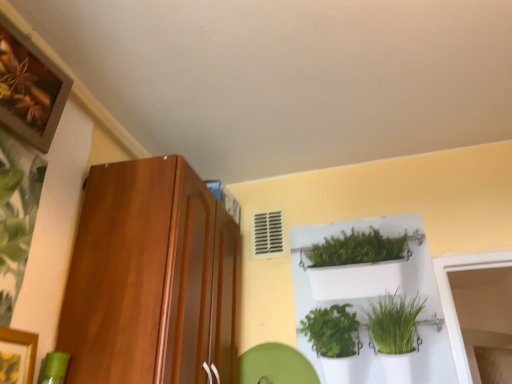
Describe the element at coordinates (365, 283) in the screenshot. I see `white plastic shelf at upper center` at that location.

Where is `white plastic shelf at upper center`? The height and width of the screenshot is (384, 512). white plastic shelf at upper center is located at coordinates (365, 283).

Locate an element on the screen. The width and height of the screenshot is (512, 384). wooden framed artwork at upper left is located at coordinates (29, 88).

Describe the element at coordinates (16, 215) in the screenshot. I see `green leafy plant at left` at that location.

The width and height of the screenshot is (512, 384). I want to click on shiny brown cabinet at left, so click(x=140, y=275).

Find the location of a particular element. Image resolution: width=512 pixels, height=384 pixels. white plastic shelf at upper center is located at coordinates (365, 283).

Consider the image. Are green leafy plant at left and shiny brown cabinet at left far apart?

No, green leafy plant at left is not far from shiny brown cabinet at left.

Is point (34, 202) in front of point (103, 260)?

Yes, point (34, 202) is in front of point (103, 260).

Does green leafy plant at left have a greater height compared to shiny brown cabinet at left?

In fact, green leafy plant at left may be shorter than shiny brown cabinet at left.

Does green leafy plant at left come behind shiny brown cabinet at left?

No, green leafy plant at left is closer to the viewer.

Between white plastic shelf at upper center and green leafy plant at left, which one has less height?

With less height is green leafy plant at left.

Is white plastic shelf at upper center spatially inside green leafy plant at left, or outside of it?

white plastic shelf at upper center lies outside green leafy plant at left.

Is point (416, 293) more distant than point (26, 159)?

Yes, point (416, 293) is behind point (26, 159).

Who is shorter, white plastic shelf at upper center or shiny brown cabinet at left?

shiny brown cabinet at left is shorter.

Is white plastic shelf at upper center surrounding shiny brown cabinet at left?

No, shiny brown cabinet at left is not inside white plastic shelf at upper center.

Does point (401, 258) come closer to viewer compared to point (161, 372)?

No, it is behind (161, 372).

In terms of width, does white plastic shelf at upper center look wider or thinner when compared to shiny brown cabinet at left?

Considering their sizes, white plastic shelf at upper center looks slimmer than shiny brown cabinet at left.

Which point is more distant from viewer, (44, 129) or (325, 291)?

The point (325, 291) is behind.

Can you see wooden framed artwork at upper left touching white plastic shelf at upper center?

wooden framed artwork at upper left and white plastic shelf at upper center are clearly separated.

Is wooden framed artwork at upper left aimed at white plastic shelf at upper center?

No, wooden framed artwork at upper left is not aimed at white plastic shelf at upper center.

Is wooden framed artwork at upper left at the left side of white plastic shelf at upper center?

Yes.

Can you confirm if white plastic shelf at upper center is thinner than wooden framed artwork at upper left?

Indeed, white plastic shelf at upper center has a lesser width compared to wooden framed artwork at upper left.

What's the angular difference between white plastic shelf at upper center and wooden framed artwork at upper left's facing directions?

Answer: The angular difference between white plastic shelf at upper center and wooden framed artwork at upper left is 82.7 degrees.

Where is `picture frame lying above the white plastic shelf at upper center (from the image's perspective)`? The width and height of the screenshot is (512, 384). picture frame lying above the white plastic shelf at upper center (from the image's perspective) is located at coordinates (29, 88).

Considering the relative sizes of white plastic shelf at upper center and wooden framed artwork at upper left in the image provided, is white plastic shelf at upper center smaller than wooden framed artwork at upper left?

Incorrect, white plastic shelf at upper center is not smaller in size than wooden framed artwork at upper left.

Locate an element on the screen. plant on the right of wooden framed artwork at upper left is located at coordinates (16, 215).

Is point (13, 222) in front of point (66, 77)?

Yes, point (13, 222) is closer to viewer.

From the image's perspective, is green leafy plant at left on top of wooden framed artwork at upper left?

No, from the image's perspective, green leafy plant at left is not on top of wooden framed artwork at upper left.

How distant is green leafy plant at left from wooden framed artwork at upper left?

green leafy plant at left is 16.11 centimeters away from wooden framed artwork at upper left.

Could you tell me if shiny brown cabinet at left is turned towards wooden framed artwork at upper left?

No, shiny brown cabinet at left is not oriented towards wooden framed artwork at upper left.

Relative to wooden framed artwork at upper left, is shiny brown cabinet at left in front or behind?

Visually, shiny brown cabinet at left is located behind wooden framed artwork at upper left.

Which is more distant, (x=106, y=360) or (x=17, y=28)?

The point (x=17, y=28) is farther from the camera.

From the image's perspective, is shiny brown cabinet at left below wooden framed artwork at upper left?

Correct, shiny brown cabinet at left appears lower than wooden framed artwork at upper left in the image.

Find the location of a particular element. The height and width of the screenshot is (384, 512). cabinetry that appears above the green leafy plant at left (from a real-world perspective) is located at coordinates (140, 275).

Find the location of a particular element. The width and height of the screenshot is (512, 384). plant that appears above the white plastic shelf at upper center (from the image's perspective) is located at coordinates (16, 215).

Which object lies further to the anchor point green leafy plant at left, shiny brown cabinet at left or white plastic shelf at upper center?

white plastic shelf at upper center is further to green leafy plant at left.

Looking at the image, which one is located further to white plastic shelf at upper center, shiny brown cabinet at left or wooden framed artwork at upper left?

wooden framed artwork at upper left lies further to white plastic shelf at upper center than the other object.

Consider the image. Considering their positions, is wooden framed artwork at upper left positioned further to shiny brown cabinet at left than green leafy plant at left?

wooden framed artwork at upper left lies further to shiny brown cabinet at left than the other object.

Estimate the real-world distances between objects in this image. Which object is closer to shiny brown cabinet at left, white plastic shelf at upper center or green leafy plant at left?

The object closer to shiny brown cabinet at left is green leafy plant at left.

Looking at the image, which one is located closer to white plastic shelf at upper center, wooden framed artwork at upper left or shiny brown cabinet at left?

Among the two, shiny brown cabinet at left is located nearer to white plastic shelf at upper center.

Estimate the real-world distances between objects in this image. Which object is closer to shiny brown cabinet at left, wooden framed artwork at upper left or white plastic shelf at upper center?

Among the two, wooden framed artwork at upper left is located nearer to shiny brown cabinet at left.

When comparing their distances from green leafy plant at left, does shiny brown cabinet at left or wooden framed artwork at upper left seem further?

shiny brown cabinet at left is further to green leafy plant at left.

Considering their positions, is green leafy plant at left positioned closer to white plastic shelf at upper center than shiny brown cabinet at left?

The object closer to white plastic shelf at upper center is shiny brown cabinet at left.

What are the coordinates of `plant between wooden framed artwork at upper left and white plastic shelf at upper center from left to right` in the screenshot? It's located at (16, 215).

Locate an element on the screen. This screenshot has width=512, height=384. cabinetry located between wooden framed artwork at upper left and white plastic shelf at upper center in the left-right direction is located at coordinates (140, 275).

At what (x,y) coordinates should I click in order to perform the action: click on cabinetry located between green leafy plant at left and white plastic shelf at upper center in the left-right direction. Please return your answer as a coordinate pair (x, y). This screenshot has width=512, height=384. Looking at the image, I should click on (140, 275).

Where is `plant between wooden framed artwork at upper left and shiny brown cabinet at left vertically`? The image size is (512, 384). plant between wooden framed artwork at upper left and shiny brown cabinet at left vertically is located at coordinates (16, 215).